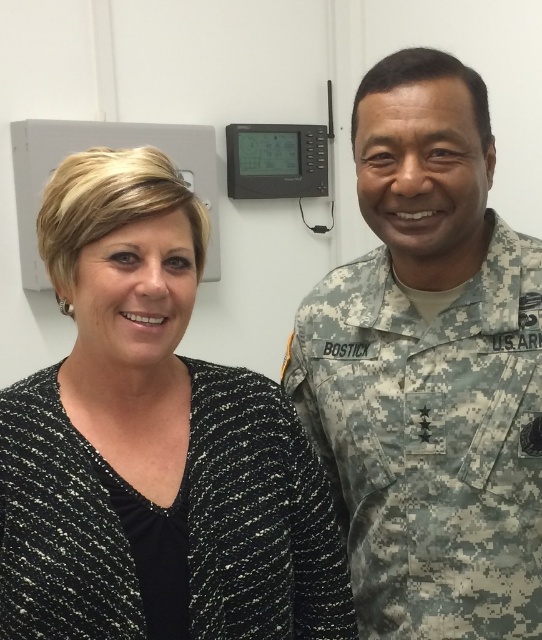
Question: Can you confirm if black speckled sweater at left is thinner than camouflage uniform at right?

Choices:
 (A) no
 (B) yes

Answer: (A)

Question: Does black speckled sweater at left come in front of camouflage uniform at right?

Choices:
 (A) yes
 (B) no

Answer: (A)

Question: Does black speckled sweater at left appear under camouflage uniform at right?

Choices:
 (A) no
 (B) yes

Answer: (B)

Question: Among these points, which one is farthest from the camera?

Choices:
 (A) (147, 244)
 (B) (376, 131)

Answer: (B)